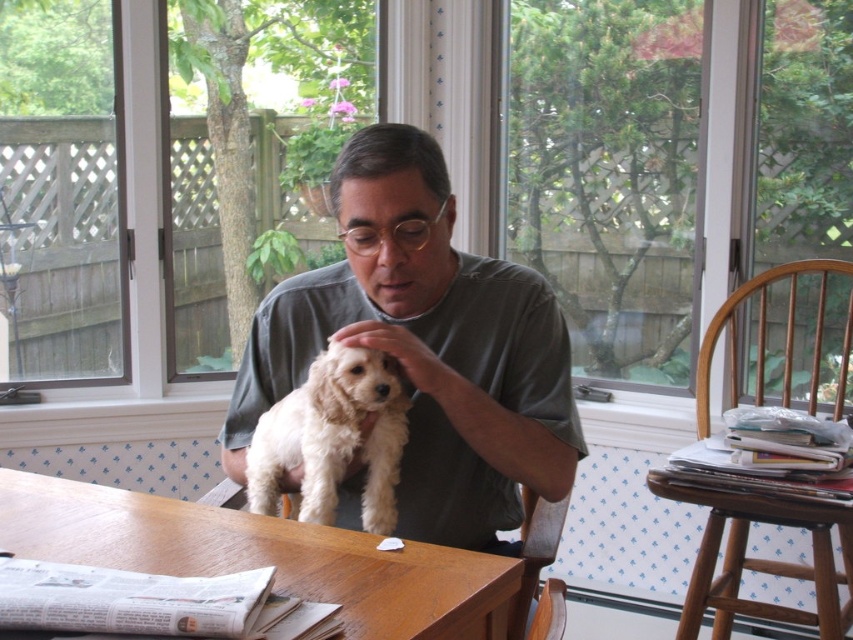
You are a delivery robot with a 20 inch wide package. You need to place it between the gray cotton shirt at center and the wooden stool at lower right. Is there enough space?

The distance between the gray cotton shirt at center and the wooden stool at lower right is 30.41 inches. Since the package is 20 inches wide, there is enough space to place it between them.

You are an AI analyzing the image. The point with coordinates (426, 348) is located on which object in the scene?

The point with coordinates (426, 348) is on the gray cotton shirt at center.

From the picture: You are standing in the room and want to place a small plant pot between the wooden table at center and the white fluffy dog at center. Based on their positions, which object should the plant pot be closer to?

The wooden table at center is to the left of the white fluffy dog at center, so the plant pot should be placed closer to the wooden table at center since it is positioned to the left side of the dog.